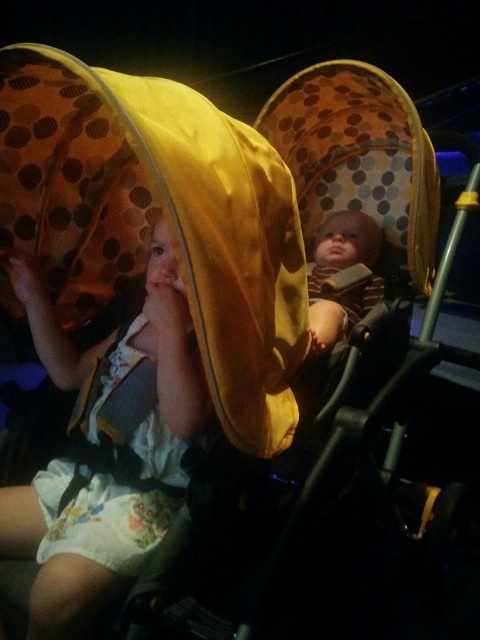
Question: Which point is farther to the camera?

Choices:
 (A) yellow fabric blanket at upper left
 (B) matte yellow hood at upper left
 (C) striped knit sweater at center

Answer: (C)

Question: Does yellow fabric blanket at upper left appear under matte yellow hood at upper left?

Choices:
 (A) no
 (B) yes

Answer: (A)

Question: Which object is closer to the camera taking this photo?

Choices:
 (A) matte yellow hood at upper left
 (B) yellow fabric blanket at upper left

Answer: (B)

Question: Among these objects, which one is farthest from the camera?

Choices:
 (A) yellow fabric blanket at upper left
 (B) matte yellow hood at upper left
 (C) striped knit sweater at center

Answer: (C)

Question: Can you confirm if yellow fabric blanket at upper left is bigger than matte yellow hood at upper left?

Choices:
 (A) yes
 (B) no

Answer: (A)

Question: Does yellow fabric blanket at upper left have a larger size compared to matte yellow hood at upper left?

Choices:
 (A) no
 (B) yes

Answer: (B)